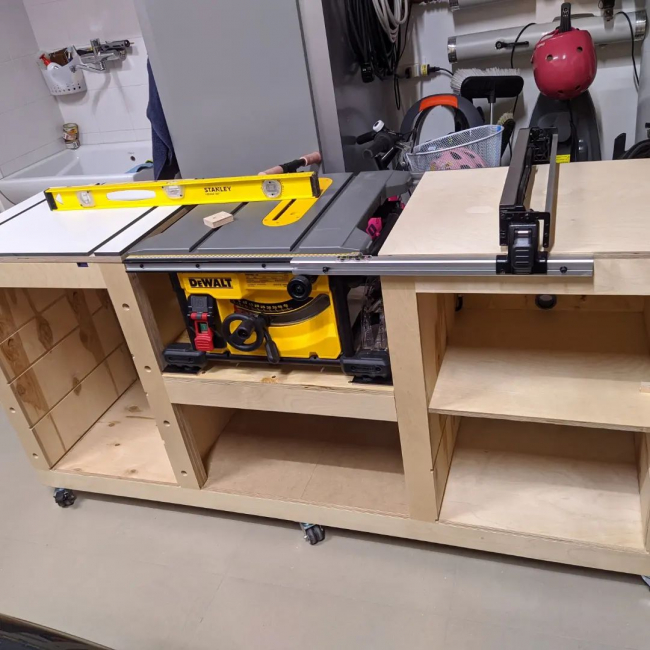
The width and height of the screenshot is (650, 650). Identify the location of basket. (56, 75).